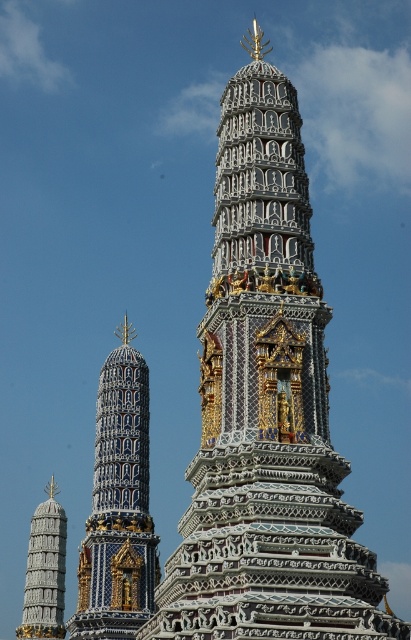
Between white glossy temple at center and blue glazed tiles at left, which one has more height?

white glossy temple at center

In the scene shown: Is white glossy temple at center bigger than blue glazed tiles at left?

Correct, white glossy temple at center is larger in size than blue glazed tiles at left.

Is point (323, 410) behind point (145, 611)?

No, it is in front of (145, 611).

In order to click on white glossy temple at center in this screenshot , I will do `click(265, 410)`.

Measure the distance between point (223, 561) and camera.

They are 51.90 meters apart.

Can you confirm if white glossy temple at center is positioned above white stone tower at lower left?

Yes, white glossy temple at center is above white stone tower at lower left.

Is point (256, 444) closer to viewer compared to point (30, 545)?

That is True.

You are a GUI agent. You are given a task and a screenshot of the screen. Output one action in this format:
    pyautogui.click(x=<x>, y=<y>)
    Task: Click on the white glossy temple at center
    The width and height of the screenshot is (411, 640).
    Given the screenshot: What is the action you would take?
    pyautogui.click(x=265, y=410)

Who is positioned more to the left, blue glazed tiles at left or white stone tower at lower left?

From the viewer's perspective, white stone tower at lower left appears more on the left side.

Which is below, blue glazed tiles at left or white stone tower at lower left?

white stone tower at lower left is below.

Locate an element on the screen. The width and height of the screenshot is (411, 640). blue glazed tiles at left is located at coordinates (119, 506).

Locate an element on the screen. This screenshot has height=640, width=411. blue glazed tiles at left is located at coordinates (119, 506).